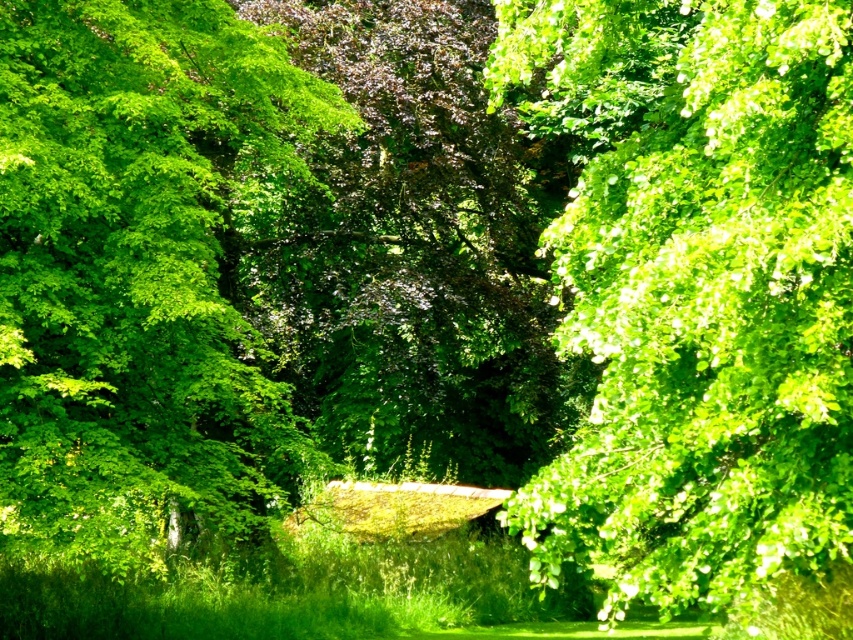
Question: Which object is positioned farthest from the green leafy tree at left?

Choices:
 (A) green leafy tree at upper right
 (B) green leafy tree at center

Answer: (B)

Question: Is green leafy tree at upper right thinner than green leafy tree at left?

Choices:
 (A) yes
 (B) no

Answer: (A)

Question: From the image, what is the correct spatial relationship of green leafy tree at upper right in relation to green leafy tree at center?

Choices:
 (A) above
 (B) below

Answer: (A)

Question: Estimate the real-world distances between objects in this image. Which object is closer to the green leafy tree at upper right?

Choices:
 (A) green leafy tree at left
 (B) green leafy tree at center

Answer: (A)

Question: Among these points, which one is farthest from the camera?

Choices:
 (A) (202, 440)
 (B) (635, 72)
 (C) (386, 468)

Answer: (C)

Question: Can you confirm if green leafy tree at upper right is positioned to the left of green leafy tree at center?

Choices:
 (A) no
 (B) yes

Answer: (A)